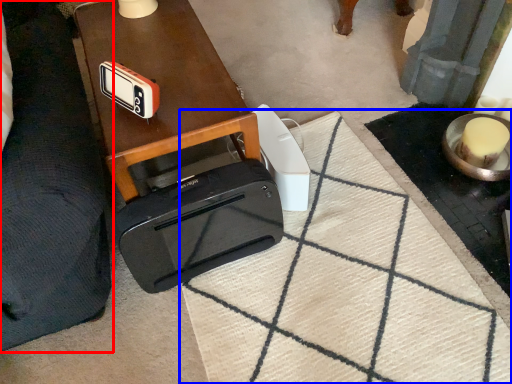
Question: Among these objects, which one is nearest to the camera, furniture (highlighted by a red box) or doormat (highlighted by a blue box)?

Choices:
 (A) furniture
 (B) doormat

Answer: (A)